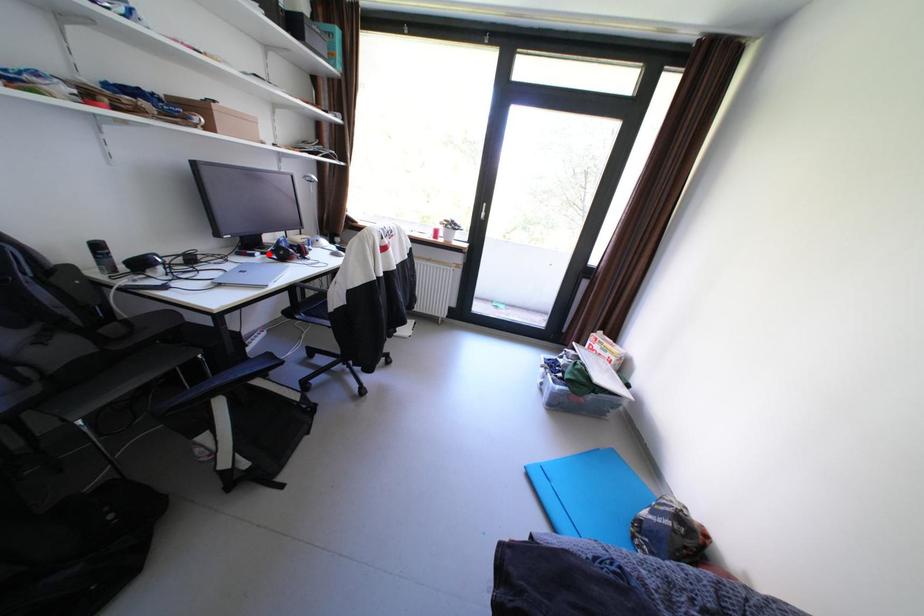
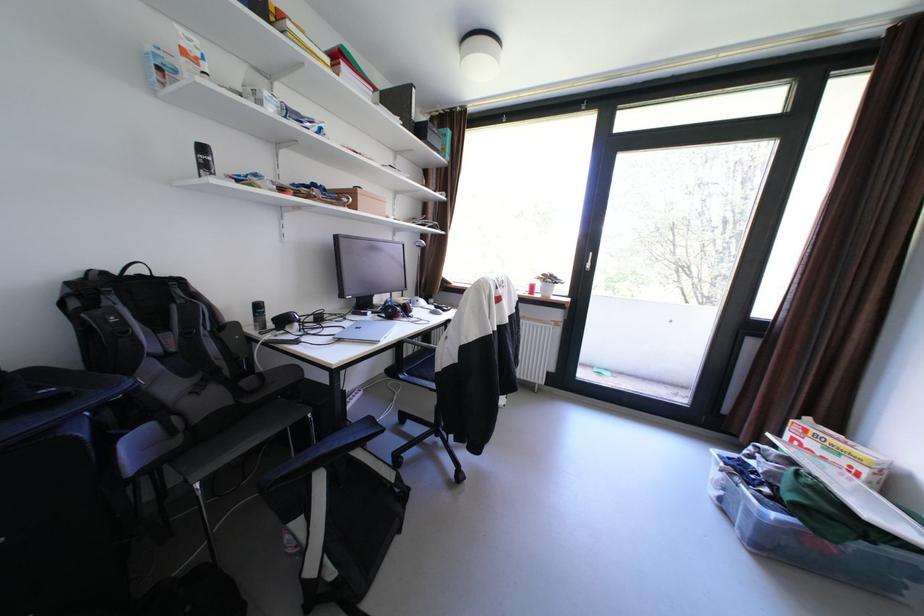
Locate, in the second image, the point that corresponds to the highlighted location in the first image.

(380, 313)